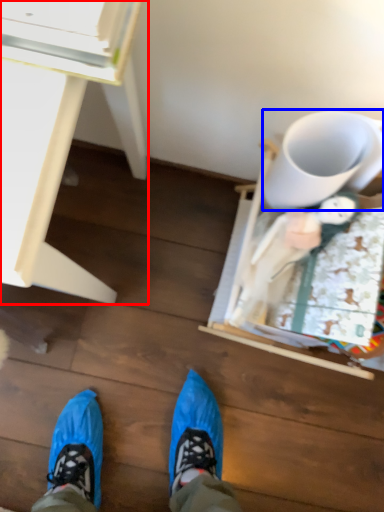
Question: Among these objects, which one is nearest to the camera, desk (highlighted by a red box) or mug (highlighted by a blue box)?

Choices:
 (A) desk
 (B) mug

Answer: (A)